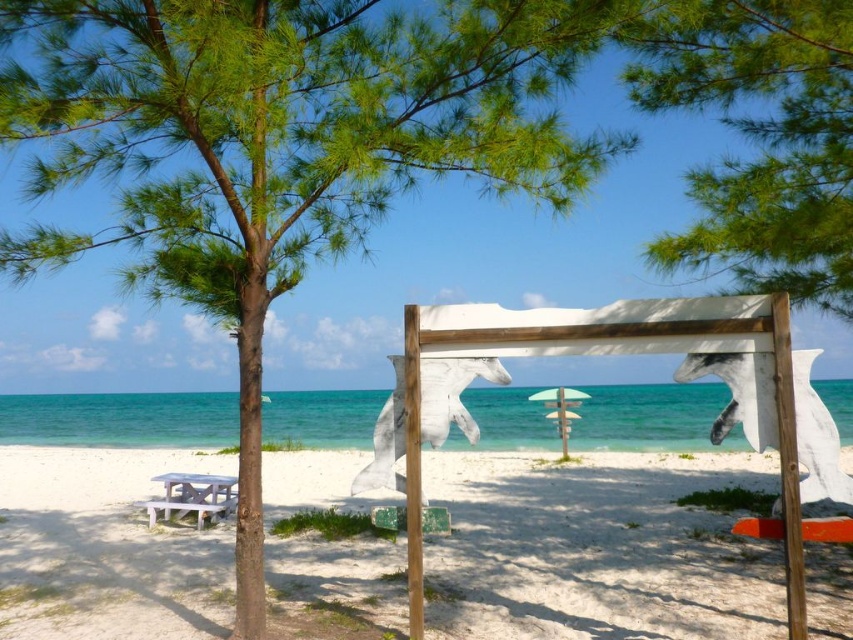
Question: Which point is closer to the camera taking this photo?

Choices:
 (A) tap(199, 504)
 (B) tap(460, 609)
 (C) tap(556, 419)

Answer: (B)

Question: Which point is closer to the camera?

Choices:
 (A) (393, 602)
 (B) (201, 496)
 (C) (786, 186)
 (D) (560, 412)

Answer: (C)

Question: Does white wooden sign at center appear over white plastic beach chair at lower left?

Choices:
 (A) yes
 (B) no

Answer: (B)

Question: Among these points, which one is farthest from the camera?

Choices:
 (A) (202, 522)
 (B) (740, 42)

Answer: (A)

Question: From the image, what is the correct spatial relationship of white wooden sign at center in relation to green fabric umbrella at center?

Choices:
 (A) right
 (B) left

Answer: (B)

Question: Where is white plastic beach chair at lower left located in relation to green fabric umbrella at center in the image?

Choices:
 (A) above
 (B) below

Answer: (B)